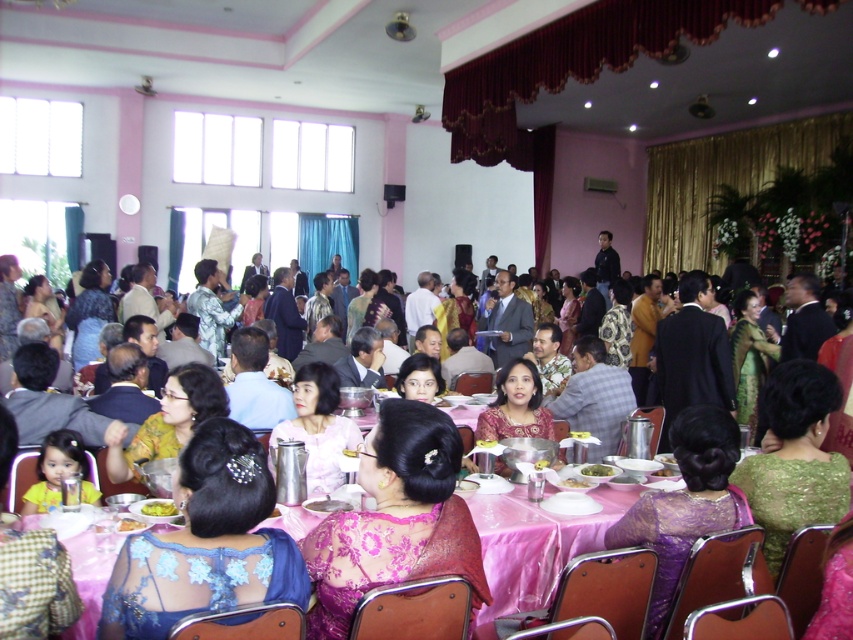
Question: Can you confirm if pink glossy bowl at center is wider than smooth white plate at center?

Choices:
 (A) yes
 (B) no

Answer: (A)

Question: Which object is positioned farthest from the smooth white plate at center?

Choices:
 (A) smooth plastic fork at center
 (B) smooth white plate at lower center
 (C) smooth plastic bowl at center

Answer: (B)

Question: Observing the image, what is the correct spatial positioning of silky pink dress at center in reference to smooth white plate at lower center?

Choices:
 (A) below
 (B) above

Answer: (B)

Question: Which object appears farthest from the camera in this image?

Choices:
 (A) blue lace dress at center
 (B) pink glossy bowl at center
 (C) purple lace dress at center
 (D) smooth plastic fork at center

Answer: (D)

Question: Is yellow matte bowl at lower center in front of smooth plastic bowl at center?

Choices:
 (A) no
 (B) yes

Answer: (B)

Question: Which object is positioned closest to the smooth plastic bowl at center?

Choices:
 (A) smooth white plate at center
 (B) yellow matte bowl at lower center
 (C) pink glossy bowl at center

Answer: (C)